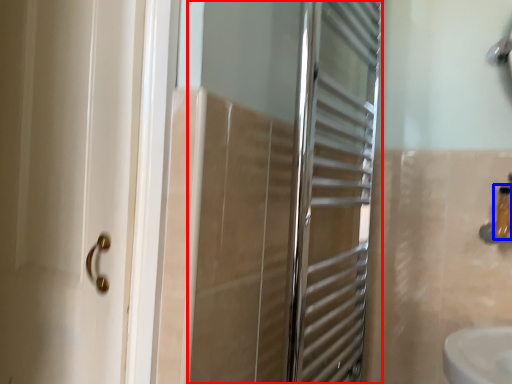
Question: Which object is further to the camera taking this photo, screen door (highlighted by a red box) or toiletry (highlighted by a blue box)?

Choices:
 (A) screen door
 (B) toiletry

Answer: (B)